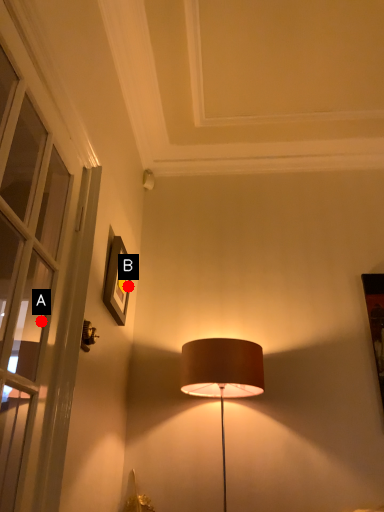
Question: Two points are circled on the image, labeled by A and B beside each circle. Among these points, which one is farthest from the camera?

Choices:
 (A) A is further
 (B) B is further

Answer: (B)